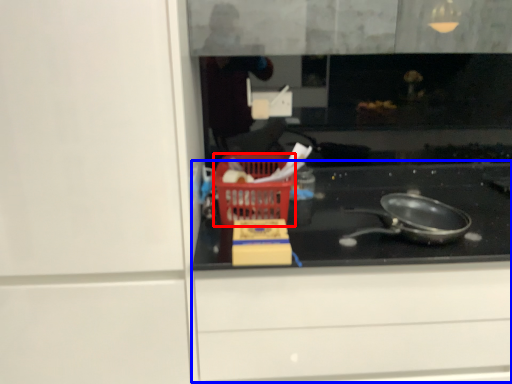
Question: Which point is further to the camera, basket (highlighted by a red box) or cabinetry (highlighted by a blue box)?

Choices:
 (A) basket
 (B) cabinetry

Answer: (A)